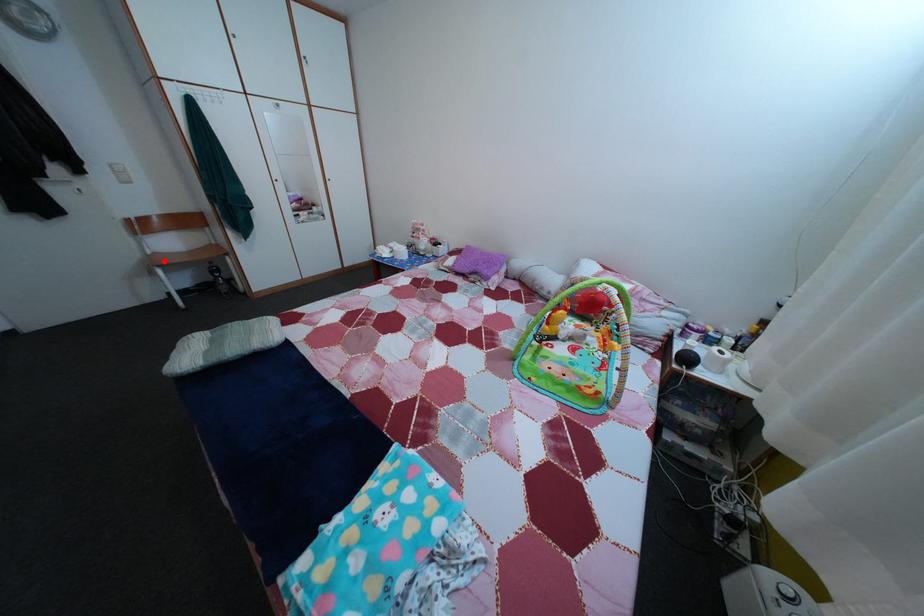
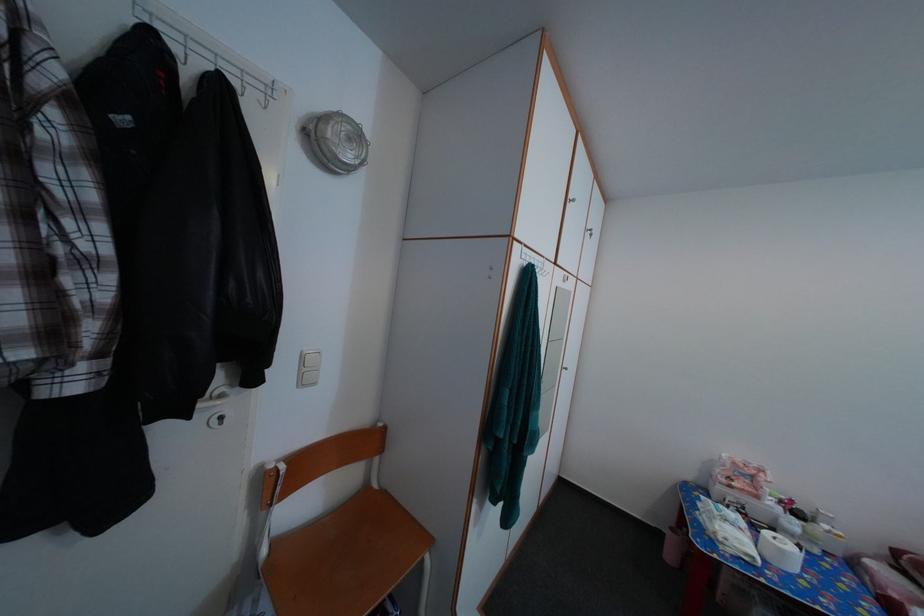
In the second image, find the point that corresponds to the highlighted location in the first image.

(282, 552)